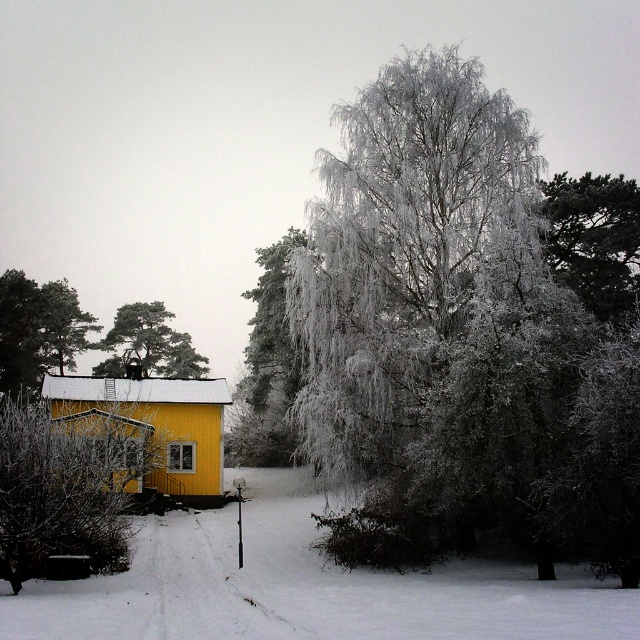
Question: Which of the following is the closest to the observer?

Choices:
 (A) icy white branches at center
 (B) snow-covered bush at lower left
 (C) smooth brown tree trunk at left

Answer: (B)

Question: Does white powdery snow at lower center appear over snow-covered pine tree at upper left?

Choices:
 (A) no
 (B) yes

Answer: (A)

Question: Is snow-covered bush at lower left smaller than dark green textured pine tree at upper right?

Choices:
 (A) yes
 (B) no

Answer: (B)

Question: Which of the following is the farthest from the observer?

Choices:
 (A) white powdery snow at lower center
 (B) icy white branches at center
 (C) smooth brown tree trunk at left
 (D) dark green textured pine tree at upper right

Answer: (C)

Question: Is icy white branches at center wider than white powdery snow at lower center?

Choices:
 (A) yes
 (B) no

Answer: (A)

Question: Which object is farther from the camera taking this photo?

Choices:
 (A) icy white branches at center
 (B) snow-covered bush at lower left
 (C) white powdery snow at lower center

Answer: (A)